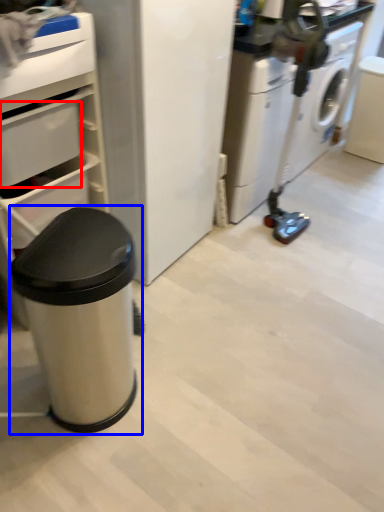
Question: Which object is closer to the camera taking this photo, drawer (highlighted by a red box) or waste container (highlighted by a blue box)?

Choices:
 (A) drawer
 (B) waste container

Answer: (B)